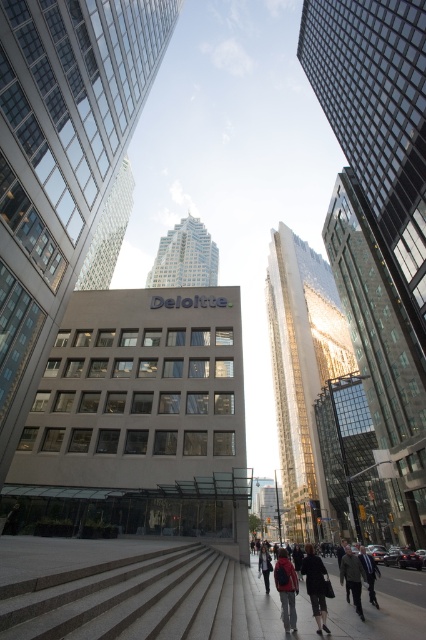
Does gray concrete pavement at center have a lesser width compared to red jacket at center?

No.

Is gray concrete pavement at center positioned before red jacket at center?

Yes.

Does point (255, 620) come in front of point (284, 554)?

Yes, it is.

You are a GUI agent. You are given a task and a screenshot of the screen. Output one action in this format:
    pyautogui.click(x=<x>, y=<y>)
    Task: Click on the gray concrete pavement at center
    
    Given the screenshot: What is the action you would take?
    pyautogui.click(x=131, y=589)

Which is above, red jacket at center or denim jacket at center?

Positioned higher is red jacket at center.

Does red jacket at center have a lesser width compared to denim jacket at center?

Correct, red jacket at center's width is less than denim jacket at center's.

Which is in front, point (287, 595) or point (267, 577)?

Point (287, 595) is more forward.

Image resolution: width=426 pixels, height=640 pixels. Identify the location of red jacket at center. (285, 589).

Between dark gray sweater at center and denim jacket at center, which one is positioned lower?

Positioned lower is denim jacket at center.

Can you confirm if dark gray sweater at center is positioned to the right of denim jacket at center?

Indeed, dark gray sweater at center is positioned on the right side of denim jacket at center.

You are a GUI agent. You are given a task and a screenshot of the screen. Output one action in this format:
    pyautogui.click(x=<x>, y=<y>)
    Task: Click on the dark gray sweater at center
    The height and width of the screenshot is (640, 426).
    Given the screenshot: What is the action you would take?
    pyautogui.click(x=316, y=586)

This screenshot has height=640, width=426. I want to click on dark gray sweater at center, so coord(316,586).